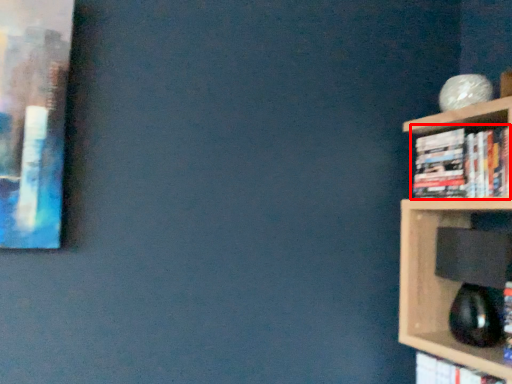
Question: Where is book (annotated by the red box) located in relation to book in the image?

Choices:
 (A) left
 (B) right

Answer: (B)